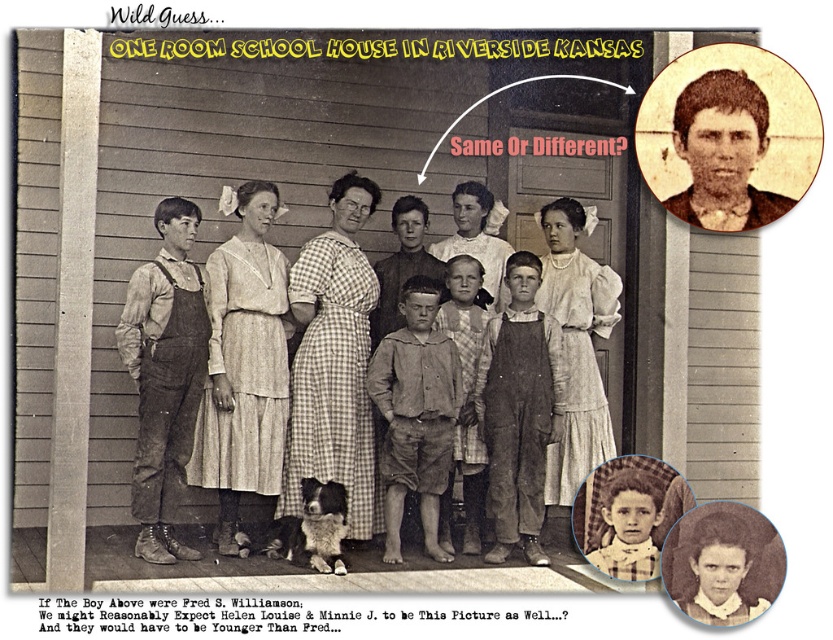
Question: Can you confirm if light beige cotton dress at center is positioned to the left of smooth white shirt at center?

Choices:
 (A) yes
 (B) no

Answer: (B)

Question: Which object is positioned closest to the smooth brown hair at upper right?

Choices:
 (A) plaid shirt at center
 (B) checkered fabric dress at center

Answer: (A)

Question: Which object appears farthest from the camera in this image?

Choices:
 (A) smooth white shirt at center
 (B) brown overalls at center
 (C) plaid shirt at center
 (D) checkered fabric dress at center

Answer: (A)

Question: Which point is farther from the camera taking this photo?

Choices:
 (A) (278, 211)
 (B) (373, 337)
 (C) (737, 564)
 (D) (489, 273)

Answer: (D)

Question: Is the position of matte brown overalls at center less distant than that of overalls at center?

Choices:
 (A) no
 (B) yes

Answer: (B)

Question: Can you confirm if checkered fabric dress at center is positioned to the left of smooth white shirt at center?

Choices:
 (A) yes
 (B) no

Answer: (A)